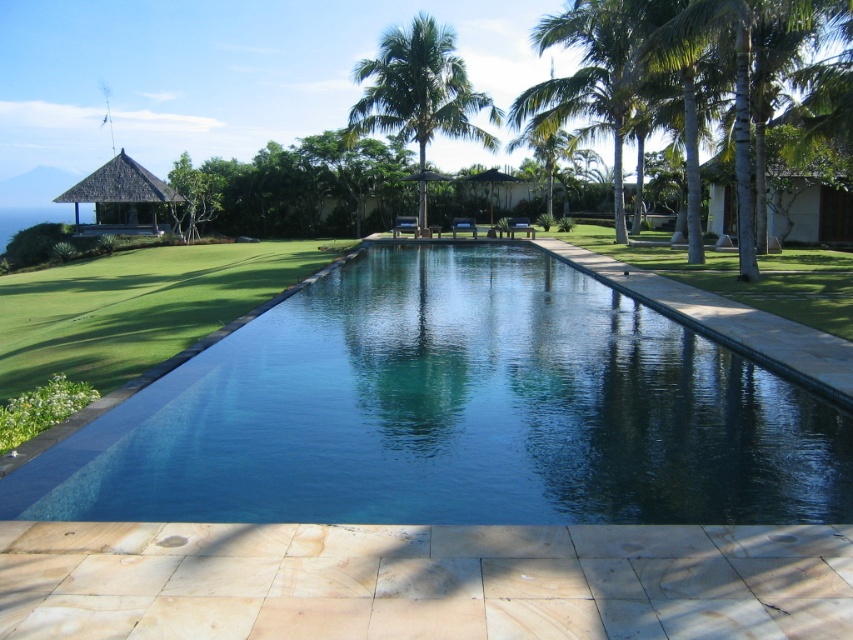
You are standing at the edge of the blue glassy swimming pool at center and want to look up at the green leafy palm tree at upper center. In which direction should you tilt your head?

You should tilt your head upward because the blue glassy swimming pool at center is located below the green leafy palm tree at upper center, so looking up will allow you to see the palm tree.

You are standing at the edge of the blue glassy swimming pool at center and want to look towards the green leafy palm tree at upper center. In which direction should you turn your head?

The blue glassy swimming pool at center is positioned on the right side of green leafy palm tree at upper center, so you should turn your head to the left to look towards the green leafy palm tree at upper center.

Consider the image. You are standing at the edge of the blue glassy swimming pool at center and want to look at the green leafy palm tree at upper center. Can you see the palm tree clearly without any obstruction?

Yes, the blue glassy swimming pool at center is in front of the green leafy palm tree at upper center, so the palm tree is visible behind the pool.